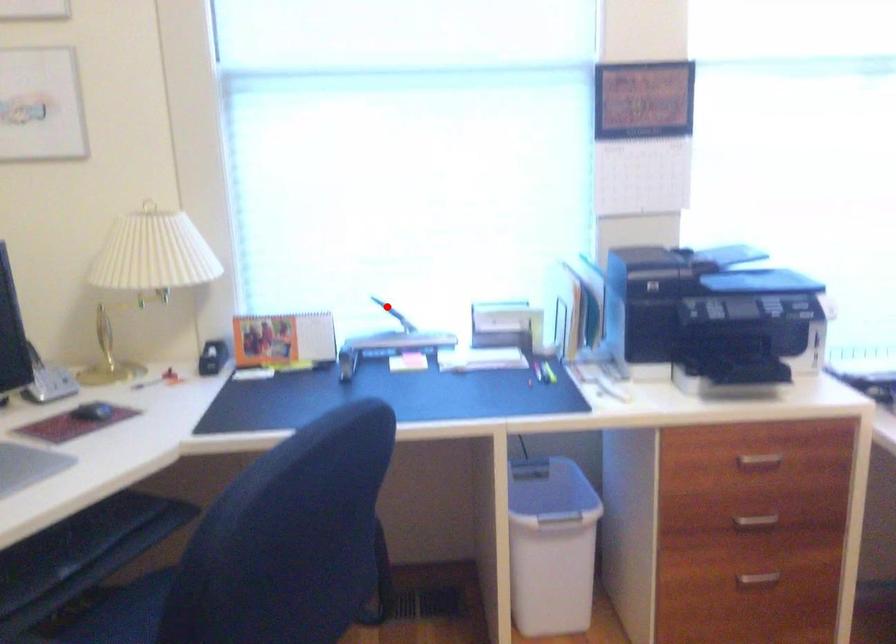
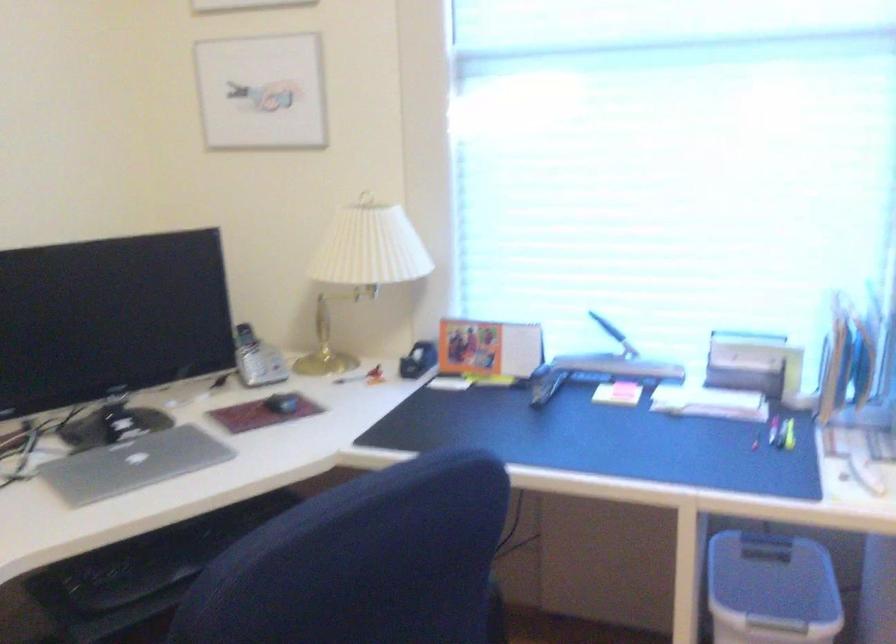
Locate, in the second image, the point that corresponds to the highlighted location in the first image.

(607, 327)